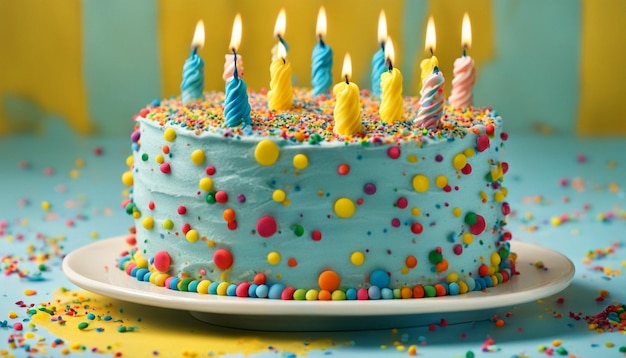
Where is `birthday candle flames`? Image resolution: width=626 pixels, height=358 pixels. birthday candle flames is located at coordinates (198, 32), (233, 33), (283, 26), (280, 56), (316, 27), (347, 66), (382, 20), (389, 49), (429, 33), (467, 30).